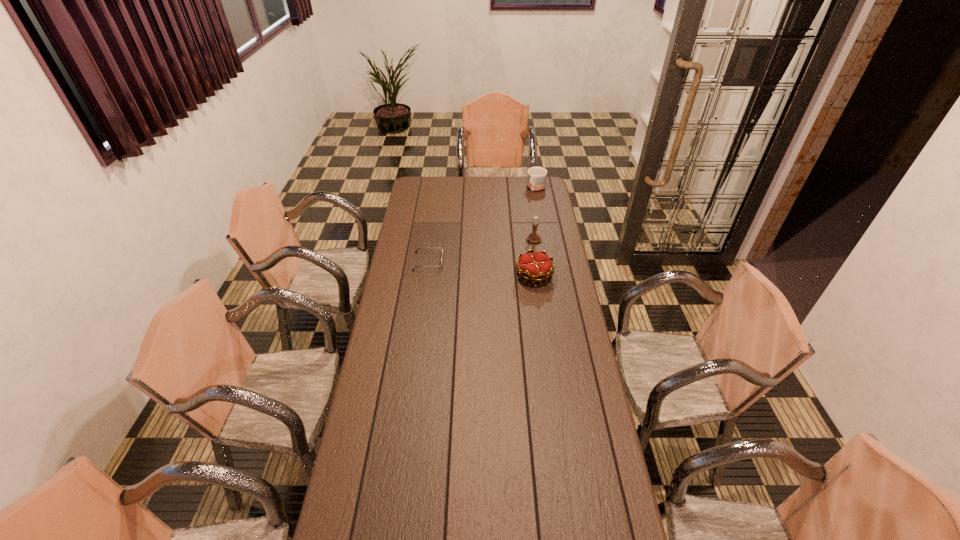
Locate an element on the screen. vacant space situated on the side of the candle holder with the handle is located at coordinates point(473,268).

Locate an element on the screen. Image resolution: width=960 pixels, height=540 pixels. vacant area located on the side with the handle of the mug is located at coordinates (530, 198).

This screenshot has width=960, height=540. In order to click on vacant area situated 0.150m on the side with the handle of the mug in this screenshot , I will do `click(523, 206)`.

Identify the location of vacant area located on the side with the handle of the mug. (516, 216).

Locate an element on the screen. Image resolution: width=960 pixels, height=540 pixels. object that is at the far edge is located at coordinates (536, 178).

You are a GUI agent. You are given a task and a screenshot of the screen. Output one action in this format:
    pyautogui.click(x=<x>, y=<y>)
    Task: Click on the object located at the left edge
    
    Given the screenshot: What is the action you would take?
    pyautogui.click(x=419, y=248)

In order to click on crown present at the right edge in this screenshot , I will do `click(536, 266)`.

In order to click on candle holder that is at the right edge in this screenshot , I will do `click(534, 237)`.

This screenshot has width=960, height=540. What are the coordinates of `mug located in the right edge section of the desktop` in the screenshot? It's located at (536, 178).

This screenshot has height=540, width=960. Identify the location of object present at the far right corner. (536, 178).